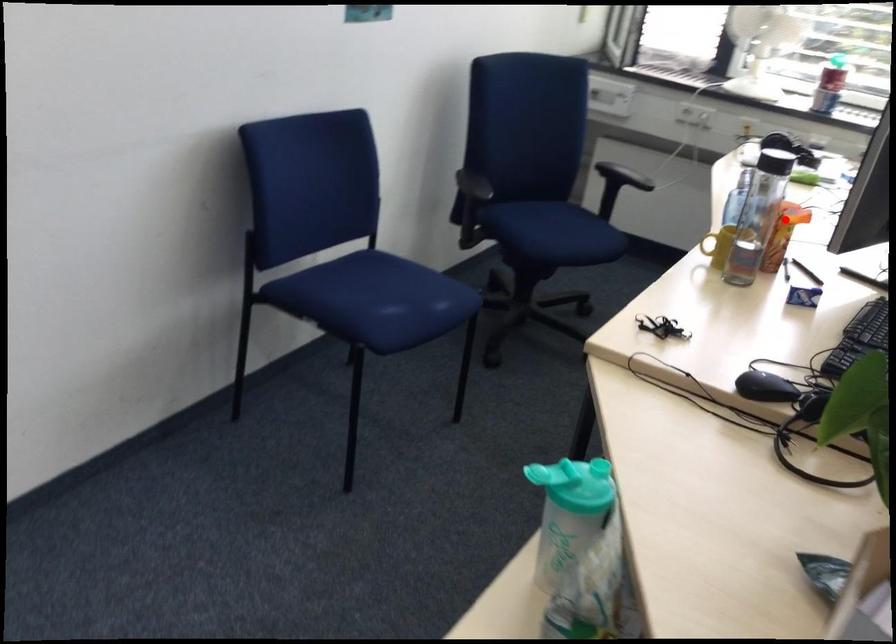
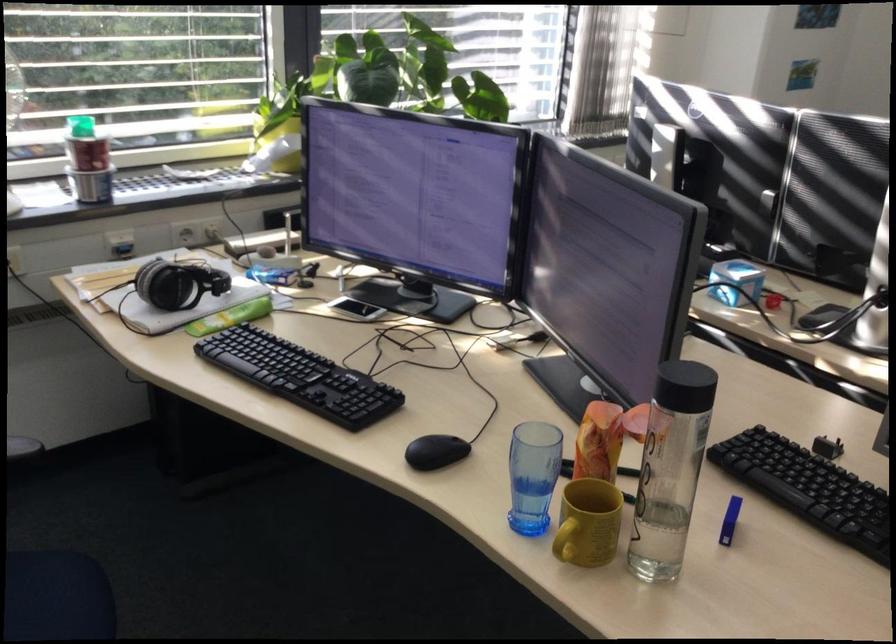
In the second image, find the point that corresponds to the highlighted location in the first image.

(599, 442)